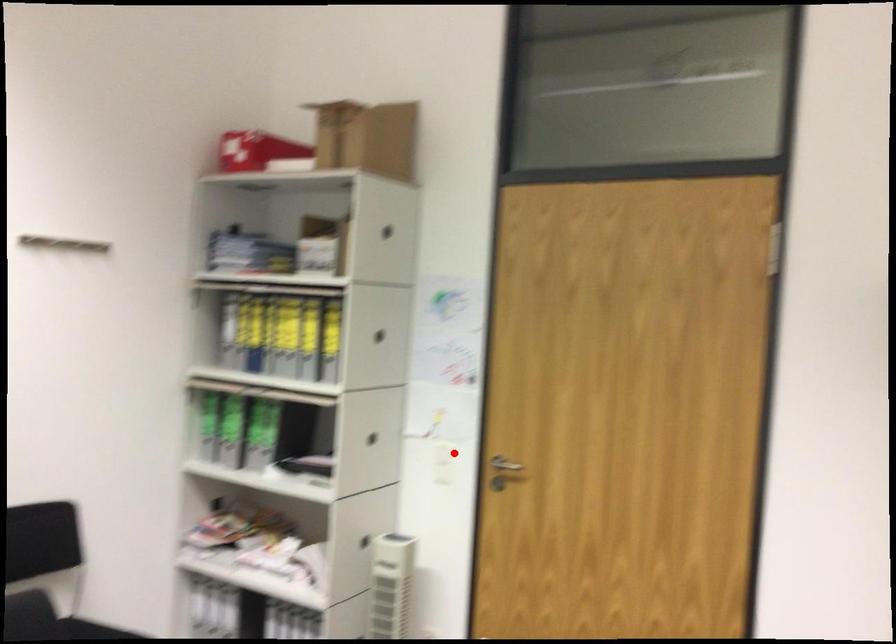
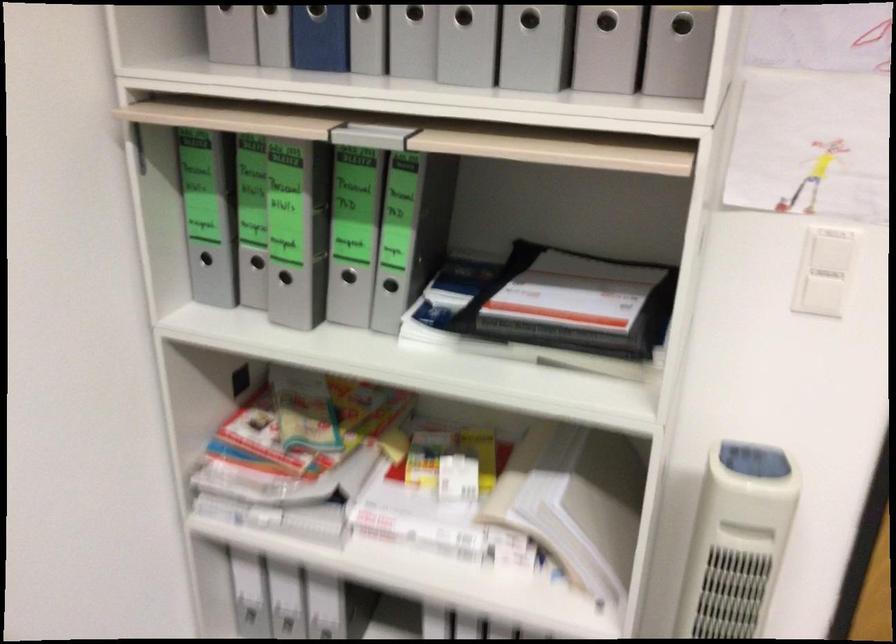
Question: I am providing you with two images of the same scene from different viewpoints. A red point is shown in image1. For the corresponding object point in image2, is it positioned nearer or farther from the camera?

Choices:
 (A) Nearer
 (B) Farther

Answer: (A)